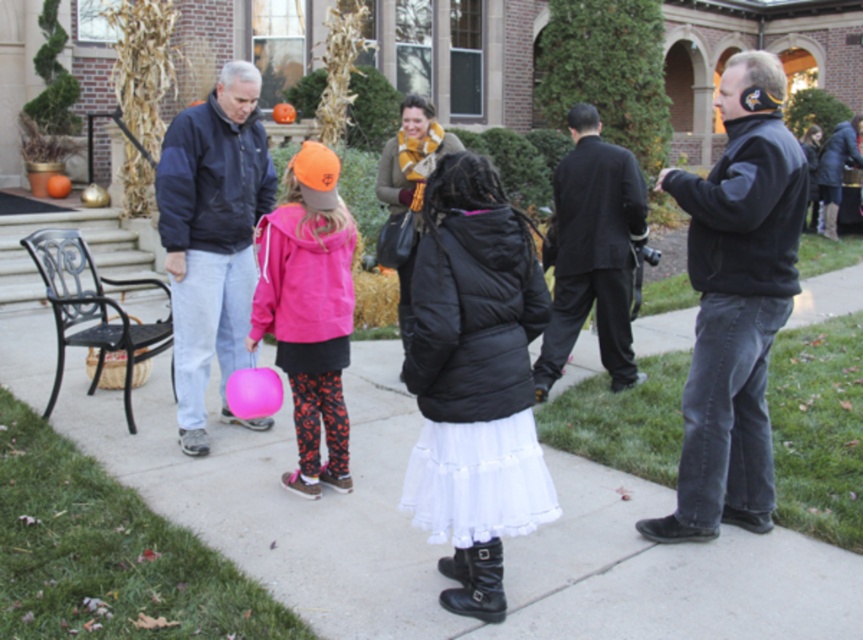
Question: Which object appears farthest from the camera in this image?

Choices:
 (A) white matte pavement at center
 (B) matte pink balloon at center
 (C) dark blue jacket at left
 (D) matte pink hoodie at center

Answer: (C)

Question: Does matte pink balloon at center have a smaller size compared to dark blue jacket at left?

Choices:
 (A) no
 (B) yes

Answer: (B)

Question: Does black fleece jacket at right appear under pink matte balloon at center?

Choices:
 (A) yes
 (B) no

Answer: (B)

Question: Is matte pink hoodie at center closer to camera compared to pink matte balloon at center?

Choices:
 (A) yes
 (B) no

Answer: (B)

Question: Which of these objects is positioned closest to the matte pink hoodie at center?

Choices:
 (A) pink matte balloon at center
 (B) white matte pavement at center

Answer: (A)

Question: Which of these objects is positioned farthest from the pink matte balloon at center?

Choices:
 (A) matte pink hoodie at center
 (B) dark blue jacket at left
 (C) white matte pavement at center

Answer: (C)